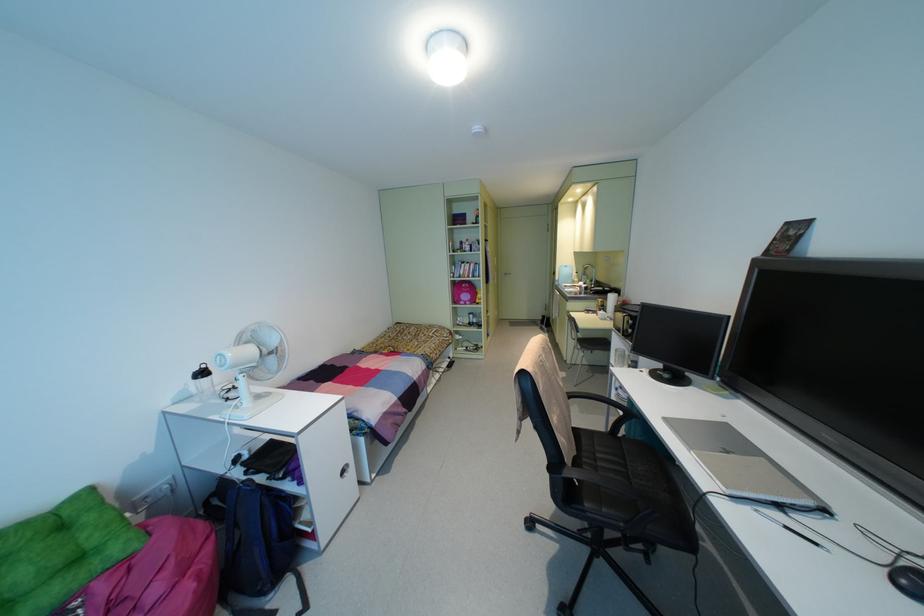
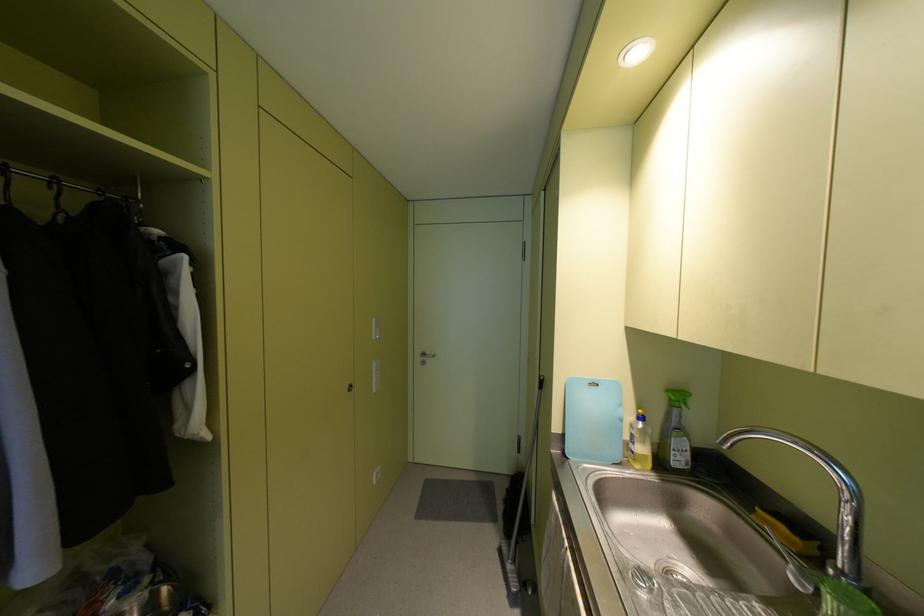
Find the pixel in the second image that matches point 553,273 in the first image.

(542, 384)